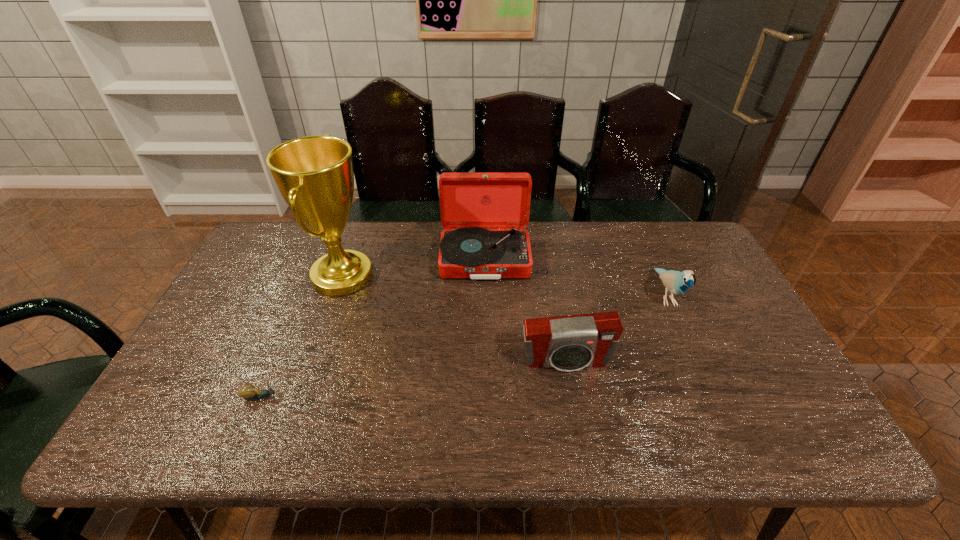
You are a GUI agent. You are given a task and a screenshot of the screen. Output one action in this format:
    pyautogui.click(x=<x>, y=<y>)
    Task: Click on the vacant space located 0.140m on the front-facing side of the shortest object
    The height and width of the screenshot is (540, 960).
    Given the screenshot: What is the action you would take?
    pyautogui.click(x=338, y=397)

Locate an element on the screen. award at the far edge is located at coordinates (314, 174).

Where is `phonograph_record located at the far edge`? The image size is (960, 540). phonograph_record located at the far edge is located at coordinates (484, 213).

Locate an element on the screen. vacant area at the far edge is located at coordinates (437, 233).

Identify the location of vacant space at the near edge of the desktop. (408, 426).

Where is `free space at the left edge of the desktop`? This screenshot has width=960, height=540. free space at the left edge of the desktop is located at coordinates (185, 412).

Locate an element on the screen. free space at the far right corner of the desktop is located at coordinates (684, 249).

Locate an element on the screen. Image resolution: width=960 pixels, height=540 pixels. vacant space in between the phonograph_record and the bird is located at coordinates (575, 277).

Image resolution: width=960 pixels, height=540 pixels. What are the coordinates of `free point between the bird and the tallest object` in the screenshot? It's located at (504, 286).

Image resolution: width=960 pixels, height=540 pixels. I want to click on blank region between the rightmost object and the award, so click(504, 286).